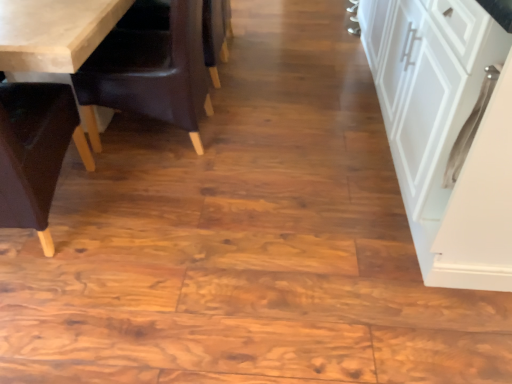
Where is `vacant point to the right of dark brown leather armchair at center`? This screenshot has height=384, width=512. vacant point to the right of dark brown leather armchair at center is located at coordinates (267, 77).